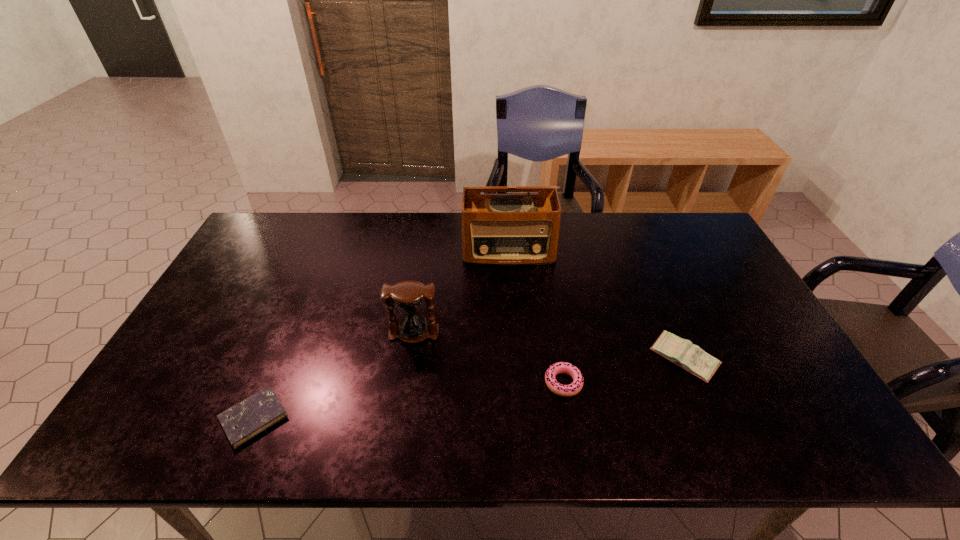
The image size is (960, 540). I want to click on the tallest object, so click(497, 229).

What are the coordinates of `radio receiver` in the screenshot? It's located at (497, 229).

The image size is (960, 540). I want to click on the fourth shortest object, so click(x=408, y=295).

Find the location of a particular element. The image size is (960, 540). hourglass is located at coordinates (408, 295).

Image resolution: width=960 pixels, height=540 pixels. What are the coordinates of `the right diary` in the screenshot? It's located at (682, 352).

I want to click on the rightmost object, so (x=682, y=352).

Find the location of a particular element. The width and height of the screenshot is (960, 540). the second shortest object is located at coordinates (575, 387).

Locate an element on the screen. the nearer diary is located at coordinates (243, 421).

The width and height of the screenshot is (960, 540). Find the location of `the shortest object`. the shortest object is located at coordinates (243, 421).

Locate an element on the screen. vacant space positioned 0.340m on the front panel of the tallest object is located at coordinates (516, 350).